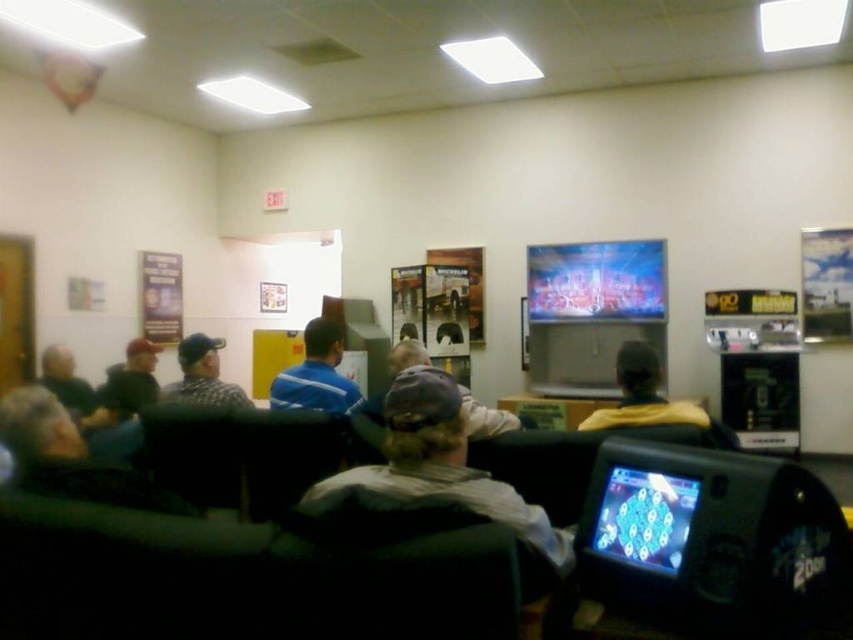
Question: Which object is positioned farthest from the gray fabric cap at center?

Choices:
 (A) gray fabric jacket at center
 (B) dark gray baseball cap at left

Answer: (B)

Question: Does blue jersey at center have a greater width compared to yellow fleece jacket at center?

Choices:
 (A) no
 (B) yes

Answer: (A)

Question: Which is nearer to the dark gray hoodie at left?

Choices:
 (A) blue jersey at center
 (B) camouflage-patterned shirt at center
 (C) yellow fleece jacket at center
 (D) gray fabric cap at center

Answer: (B)

Question: Considering the real-world distances, which object is closest to the yellow fleece jacket at center?

Choices:
 (A) dark gray hoodie at left
 (B) shiny plastic screen at lower right
 (C) dark gray baseball cap at left

Answer: (B)

Question: Can you confirm if shiny plastic screen at lower right is thinner than dark gray hoodie at left?

Choices:
 (A) yes
 (B) no

Answer: (A)

Question: Does gray fabric cap at center appear under blue jersey at center?

Choices:
 (A) no
 (B) yes

Answer: (B)